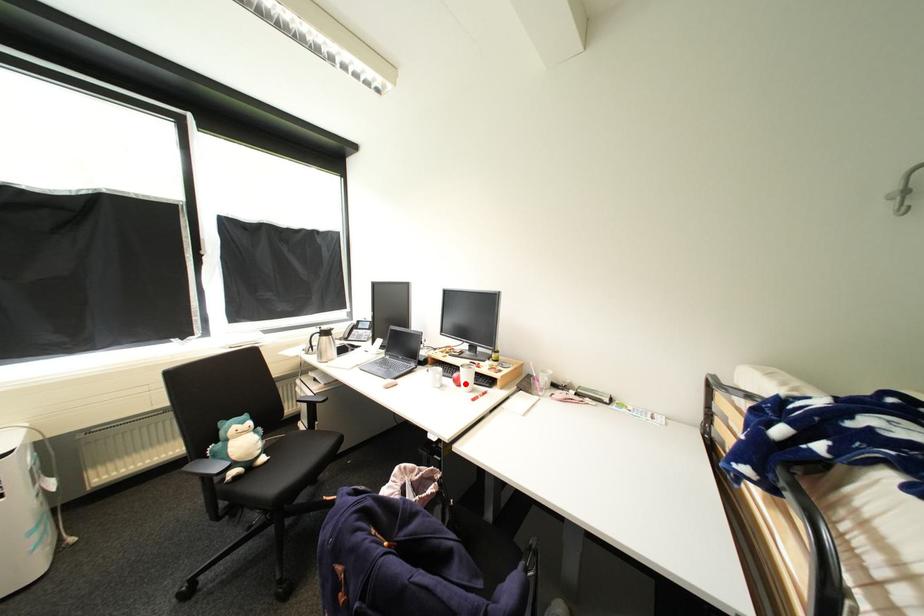
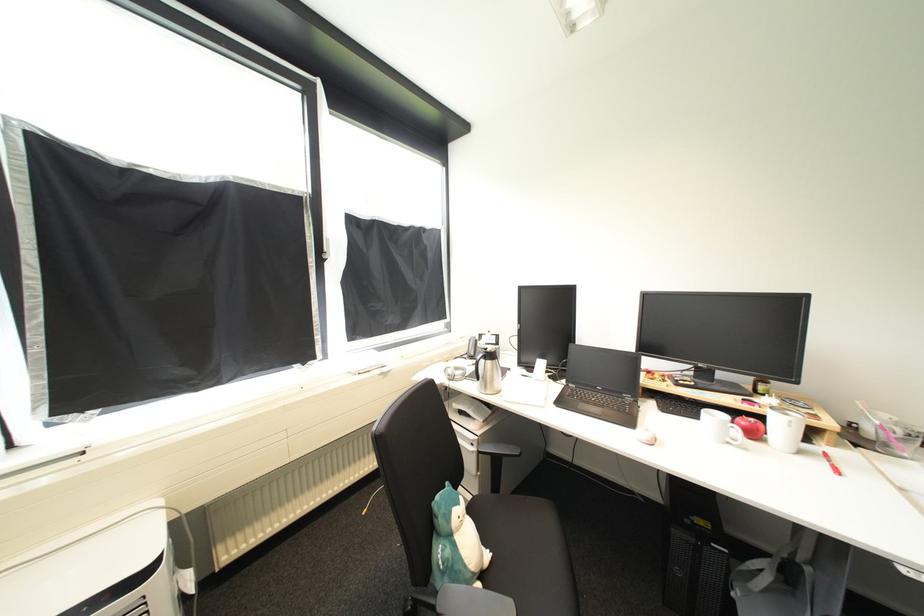
Find the pixel in the second image that matches the highlighted location in the first image.

(761, 436)